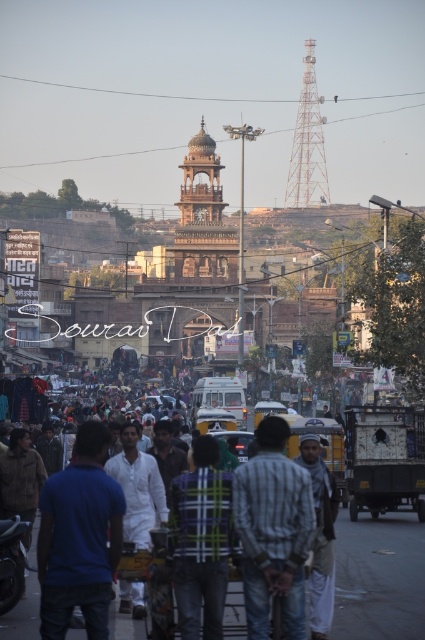
You are a tailor observing two shirts in the image. The shirts are the blue cotton shirt at center and the striped fabric shirt at center. Which shirt appears taller?

The blue cotton shirt at center has a greater height compared to the striped fabric shirt at center, so the blue cotton shirt at center appears taller.

You are a photographer trying to capture a person wearing a white cotton shirt at center and a person wearing a blue plaid shirt at center in the same frame. Based on the scene description, can you tell which shirt is positioned higher in the image?

The white cotton shirt at center is positioned higher than the blue plaid shirt at center in the image.